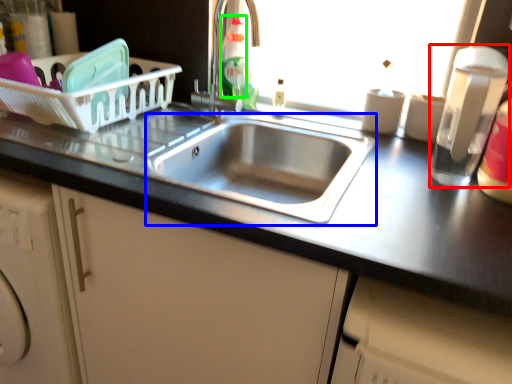
Question: Based on their relative distances, which object is nearer to appliance (highlighted by a red box)? Choose from sink (highlighted by a blue box) and bottle (highlighted by a green box).

Choices:
 (A) sink
 (B) bottle

Answer: (A)